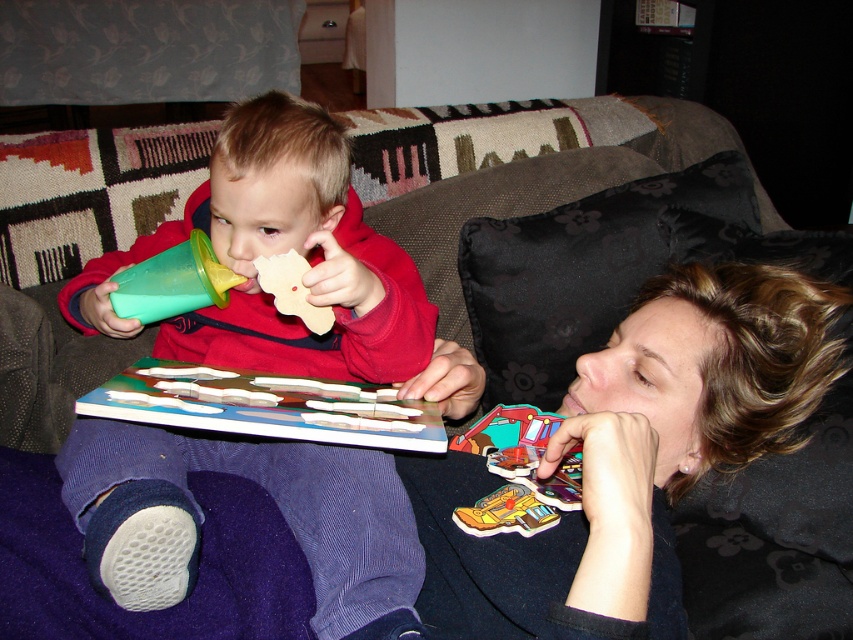
Question: Does matte black puzzle piece at upper right come behind yellow matte puzzle piece at lower center?

Choices:
 (A) yes
 (B) no

Answer: (B)

Question: Does yellow matte puzzle piece at lower center appear over wooden puzzle piece at center?

Choices:
 (A) no
 (B) yes

Answer: (A)

Question: Is matte black puzzle piece at upper right behind yellow matte puzzle piece at lower center?

Choices:
 (A) no
 (B) yes

Answer: (A)

Question: Which object is closer to the camera taking this photo?

Choices:
 (A) green plastic cup at upper left
 (B) matte plastic cup at left

Answer: (B)

Question: Estimate the real-world distances between objects in this image. Which object is closer to the matte black puzzle piece at upper right?

Choices:
 (A) green plastic cup at upper left
 (B) yellow matte puzzle piece at lower center
 (C) wooden puzzle piece at center
 (D) matte plastic cup at left

Answer: (B)

Question: Which point appears closest to the camera in this image?

Choices:
 (A) (663, 465)
 (B) (180, 442)
 (C) (283, 259)
 (D) (189, 244)

Answer: (B)